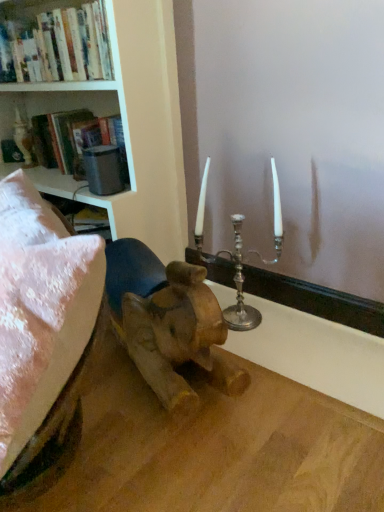
Find the location of a particular element. The width and height of the screenshot is (384, 512). vacant space in front of silver metallic candle holder at center is located at coordinates tap(270, 358).